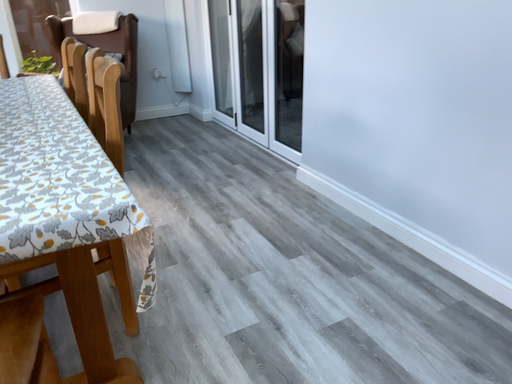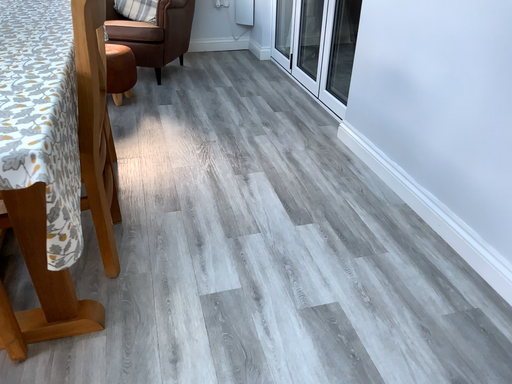
Question: Which way did the camera rotate in the video?

Choices:
 (A) rotated upward
 (B) rotated downward

Answer: (B)